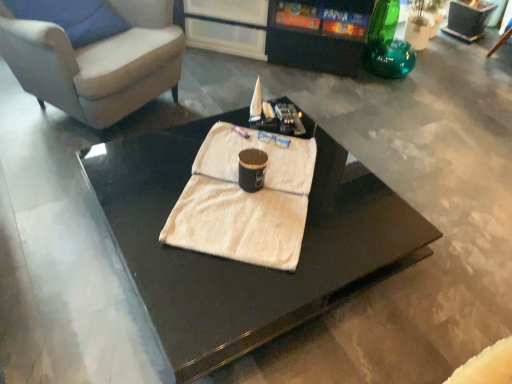
Find the location of a particular element. The width and height of the screenshot is (512, 384). vacant area that is situated to the right of white textured towel at center is located at coordinates (346, 223).